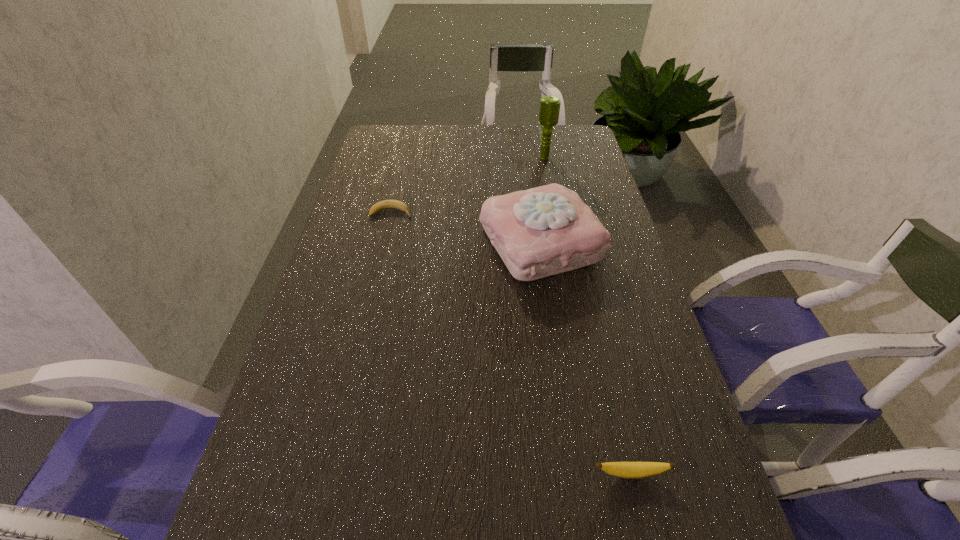
Where is `free space located at the stem of the shorter banana`? The width and height of the screenshot is (960, 540). free space located at the stem of the shorter banana is located at coordinates (502, 213).

Where is `object that is at the far edge`? Image resolution: width=960 pixels, height=540 pixels. object that is at the far edge is located at coordinates (x=549, y=110).

Identify the location of object at the left edge. (386, 204).

Where is `microphone present at the right edge`? The height and width of the screenshot is (540, 960). microphone present at the right edge is located at coordinates (549, 110).

The image size is (960, 540). Identify the location of cake that is at the right edge. (543, 231).

This screenshot has width=960, height=540. In order to click on banana located at the right edge in this screenshot , I will do `click(633, 470)`.

Find the location of `object present at the far right corner`. object present at the far right corner is located at coordinates (549, 110).

Where is `vacant space at the far edge of the desktop`? The image size is (960, 540). vacant space at the far edge of the desktop is located at coordinates (435, 134).

This screenshot has height=540, width=960. What are the coordinates of `vacant space at the left edge` in the screenshot? It's located at (356, 317).

In the image, there is a desktop. Identify the location of vacant space at the right edge. (599, 208).